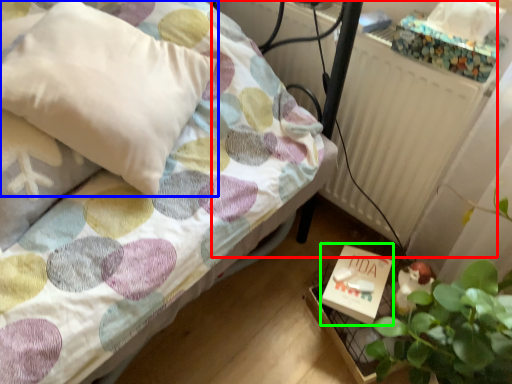
Question: Based on their relative distances, which object is nearer to radiator (highlighted by a red box)? Choose from pillow (highlighted by a blue box) and box (highlighted by a green box).

Choices:
 (A) pillow
 (B) box

Answer: (B)